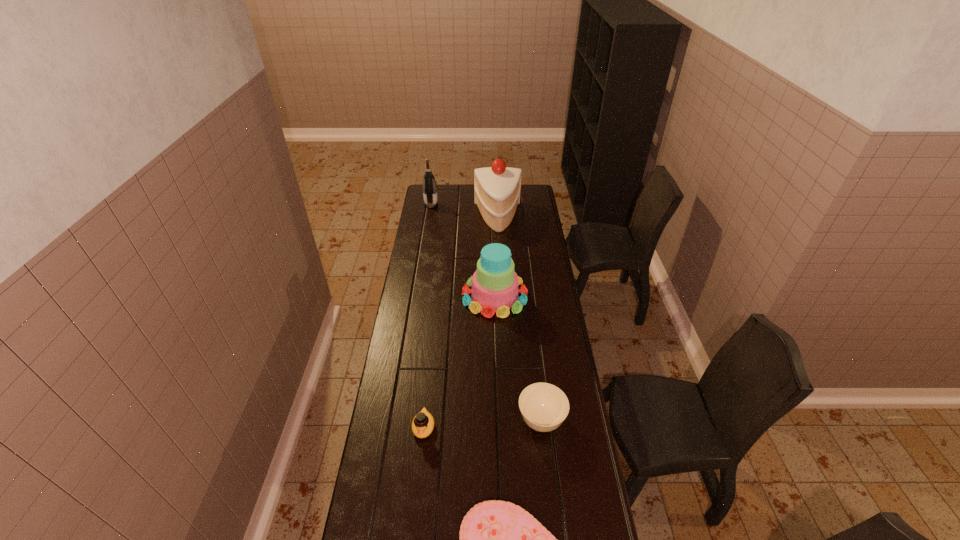
The height and width of the screenshot is (540, 960). What are the coordinates of `vacant space that satisfies the following two spatial constraints: 1. on the label of the tallest cake; 2. on the right side of the wine bottle` in the screenshot? It's located at (429, 217).

I want to click on vacant space that satisfies the following two spatial constraints: 1. on the front side of the sugar bowl; 2. on the right side of the second tallest cake, so click(x=499, y=421).

Locate an element on the screen. This screenshot has height=540, width=960. vacant point that satisfies the following two spatial constraints: 1. on the label of the tallest cake; 2. on the left side of the wine bottle is located at coordinates (429, 217).

Locate an element on the screen. free location that satisfies the following two spatial constraints: 1. on the label of the leftmost object; 2. on the left side of the fourth nearest object is located at coordinates (417, 296).